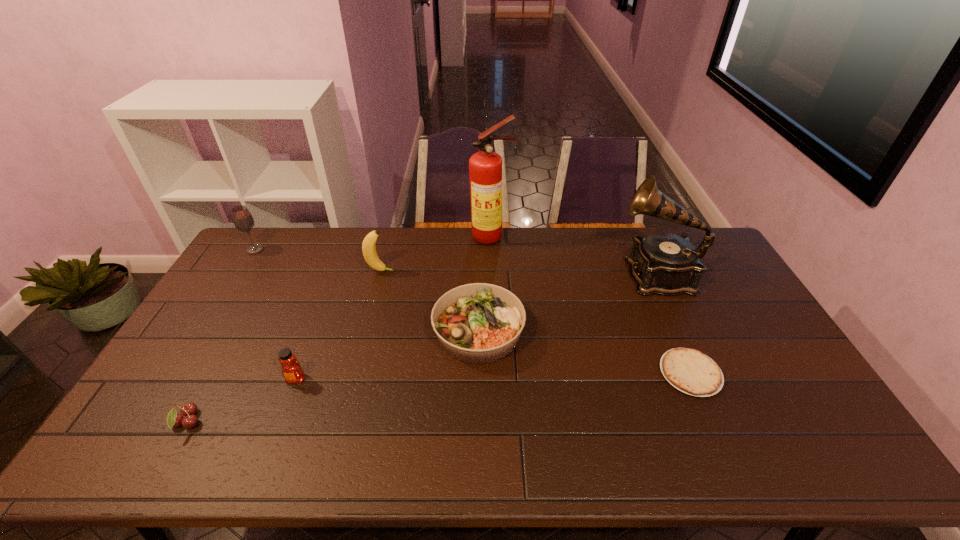
Identify the location of blank region between the salad plate and the third object from left to right. (387, 355).

This screenshot has width=960, height=540. I want to click on empty space between the nearest object and the fire extinguisher, so click(x=339, y=329).

You are a GUI agent. You are given a task and a screenshot of the screen. Output one action in this format:
    pyautogui.click(x=<x>, y=<y>)
    Task: Click on the vacant region between the shortest object and the tallest object
    
    Given the screenshot: What is the action you would take?
    pyautogui.click(x=591, y=305)

Locate an element on the screen. The width and height of the screenshot is (960, 540). free space that is in between the fourth shortest object and the cherry is located at coordinates (241, 401).

Point out which object is positioned as the seventh nearest to the tortilla. Please provide its 2D coordinates. Your answer should be formatted as a tuple, i.e. [(x, y)], where the tuple contains the x and y coordinates of a point satisfying the conditions above.

[(242, 218)]

I want to click on object that can be found as the closest to the nearest object, so click(292, 371).

The width and height of the screenshot is (960, 540). I want to click on free space that satisfies the following two spatial constraints: 1. from the stem of the salad plate; 2. on the left side of the fourth object from left to right, so click(366, 332).

Where is `vacant area in the image that satisfies the following two spatial constraints: 1. from the stem of the fourth object from left to right; 2. on the back side of the tortilla`? Image resolution: width=960 pixels, height=540 pixels. vacant area in the image that satisfies the following two spatial constraints: 1. from the stem of the fourth object from left to right; 2. on the back side of the tortilla is located at coordinates (354, 373).

At what (x,y) coordinates should I click in order to perform the action: click on free spot that satisfies the following two spatial constraints: 1. from the stem of the fourth object from left to right; 2. on the front label of the third object from left to right. Please return your answer as a coordinate pair (x, y). Looking at the image, I should click on (353, 379).

At what (x,y) coordinates should I click in order to perform the action: click on free space that satisfies the following two spatial constraints: 1. on the front-facing side of the tallest object; 2. on the leaves of the cherry. Please return your answer as a coordinate pair (x, y). The image size is (960, 540). Looking at the image, I should click on (498, 422).